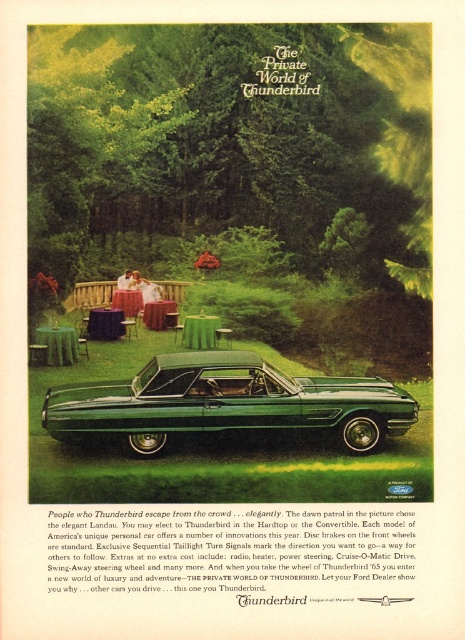
Question: Can you confirm if green metallic car at lower center is positioned to the left of green fabric picnic table at lower left?

Choices:
 (A) no
 (B) yes

Answer: (A)

Question: Can you confirm if green metallic car at lower center is bigger than green fabric picnic table at lower left?

Choices:
 (A) yes
 (B) no

Answer: (A)

Question: Which point is farther to the camera?

Choices:
 (A) (68, 340)
 (B) (372, 403)

Answer: (A)

Question: Which point appears closest to the camera in this image?

Choices:
 (A) (74, 356)
 (B) (157, 371)

Answer: (B)

Question: Does green metallic car at lower center have a larger size compared to green fabric picnic table at lower left?

Choices:
 (A) no
 (B) yes

Answer: (B)